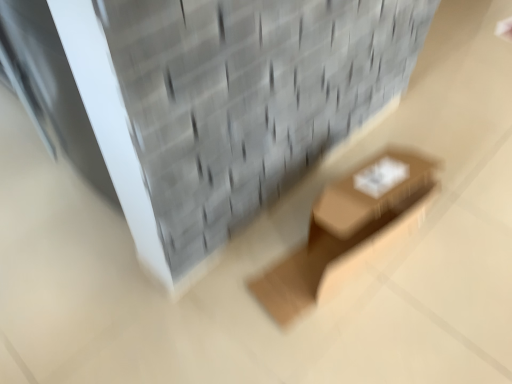
You are a GUI agent. You are given a task and a screenshot of the screen. Output one action in this format:
    pyautogui.click(x=<x>, y=<y>)
    Task: Click on the vacant region to the left of brown cardboard box at center
    The height and width of the screenshot is (384, 512).
    Given the screenshot: What is the action you would take?
    pyautogui.click(x=218, y=281)